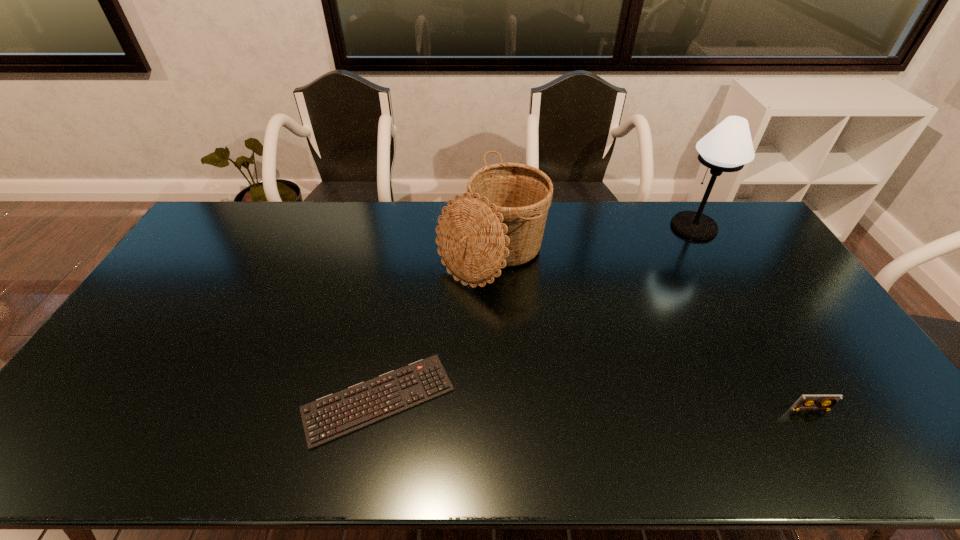
Identify the location of free space between the basket and the second shortest object. (651, 330).

Identify the location of empty space between the basket and the third tallest object. (651, 330).

Where is `vacant area that lies between the computer keyboard and the basket`? The image size is (960, 540). vacant area that lies between the computer keyboard and the basket is located at coordinates (435, 326).

Locate an element on the screen. free area in between the computer keyboard and the third tallest object is located at coordinates click(594, 404).

Find the location of `vacant area that lies between the tallest object and the second shortest object`. vacant area that lies between the tallest object and the second shortest object is located at coordinates (752, 318).

In order to click on free space between the second shortest object and the shortest object in this screenshot , I will do `click(594, 404)`.

At what (x,y) coordinates should I click in order to perform the action: click on free space that is in between the basket and the shortest object. Please return your answer as a coordinate pair (x, y). Looking at the image, I should click on (435, 326).

The image size is (960, 540). In order to click on free space between the third tallest object and the third shortest object in this screenshot , I will do `click(651, 330)`.

Identify which object is located as the nearest to the shortest object. Please provide its 2D coordinates. Your answer should be formatted as a tuple, i.e. [(x, y)], where the tuple contains the x and y coordinates of a point satisfying the conditions above.

[(501, 222)]

You are a GUI agent. You are given a task and a screenshot of the screen. Output one action in this format:
    pyautogui.click(x=<x>, y=<y>)
    Task: Click on the object that is the closest one to the videotape
    
    Given the screenshot: What is the action you would take?
    pyautogui.click(x=728, y=147)